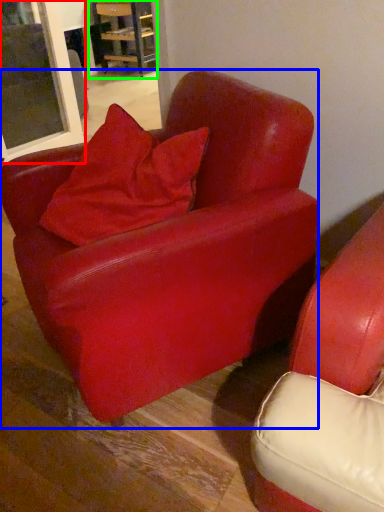
Question: Considering the real-world distances, which object is farthest from window (highlighted by a red box)? chair (highlighted by a blue box) or table (highlighted by a green box)?

Choices:
 (A) chair
 (B) table

Answer: (B)